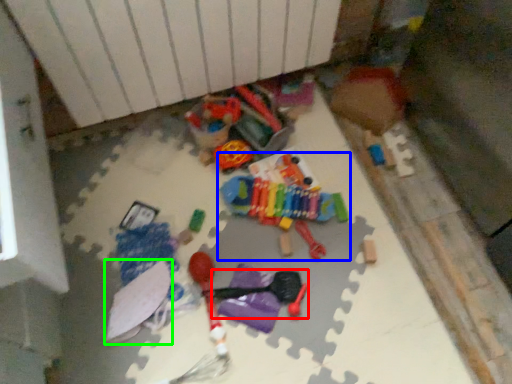
Question: Which is nearer to the toy (highlighted by a red box)? toy (highlighted by a blue box) or toy (highlighted by a green box).

Choices:
 (A) toy
 (B) toy

Answer: (A)